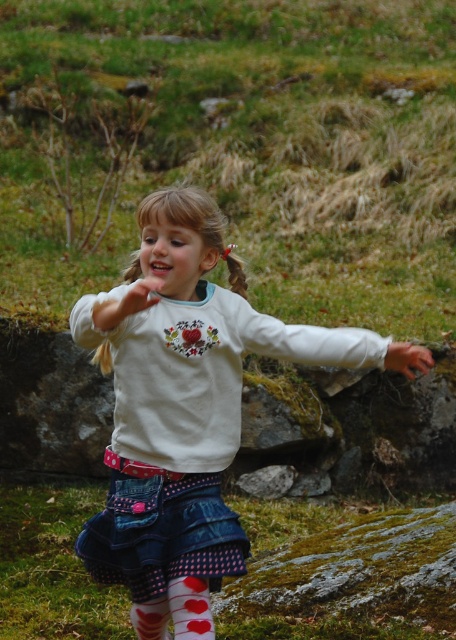
Question: Is white cotton shirt at center positioned behind white cotton sock at lower left?

Choices:
 (A) yes
 (B) no

Answer: (B)

Question: Can you confirm if white cotton shirt at center is positioned above white matte socks at lower center?

Choices:
 (A) yes
 (B) no

Answer: (A)

Question: Estimate the real-world distances between objects in this image. Which object is closer to the white matte socks at lower center?

Choices:
 (A) smooth skin hand at lower right
 (B) denim skirt at center
 (C) white cotton sock at lower left
 (D) white cotton shirt at center

Answer: (B)

Question: Based on their relative distances, which object is nearer to the white matte socks at lower center?

Choices:
 (A) white cotton shirt at center
 (B) white cotton sock at lower left

Answer: (B)

Question: Which point appears farthest from the camera in this image?

Choices:
 (A) click(x=181, y=225)
 (B) click(x=114, y=577)

Answer: (B)

Question: Can you confirm if denim skirt at center is smaller than white matte socks at lower center?

Choices:
 (A) no
 (B) yes

Answer: (A)